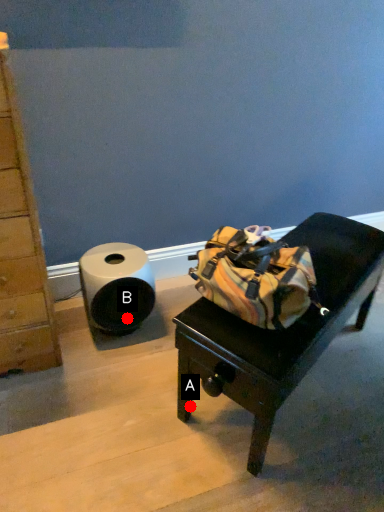
Question: Two points are circled on the image, labeled by A and B beside each circle. Which point is further to the camera?

Choices:
 (A) A is further
 (B) B is further

Answer: (B)